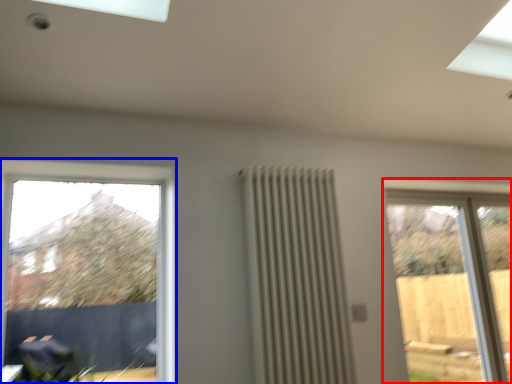
Question: Which object is closer to the camera taking this photo, window (highlighted by a red box) or window (highlighted by a blue box)?

Choices:
 (A) window
 (B) window

Answer: (B)